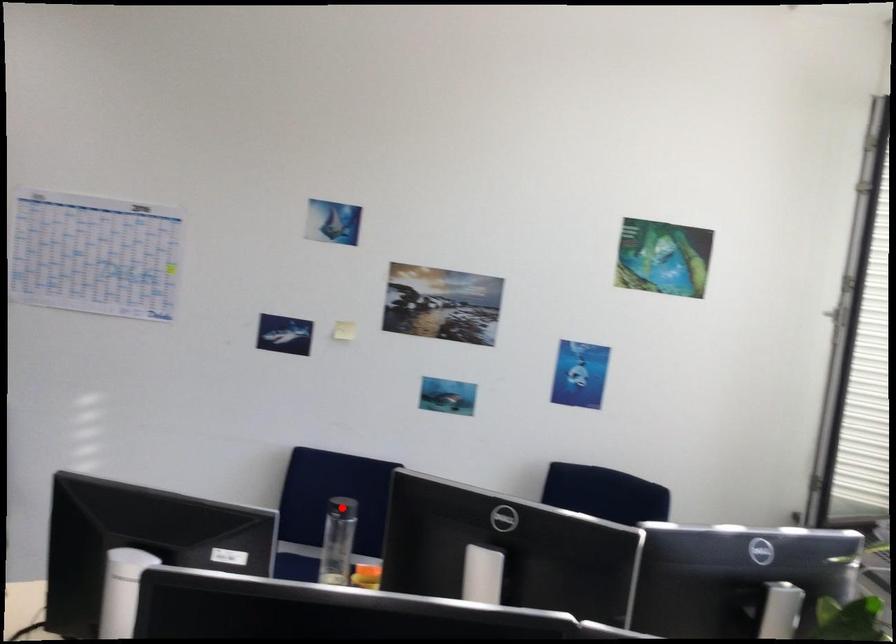
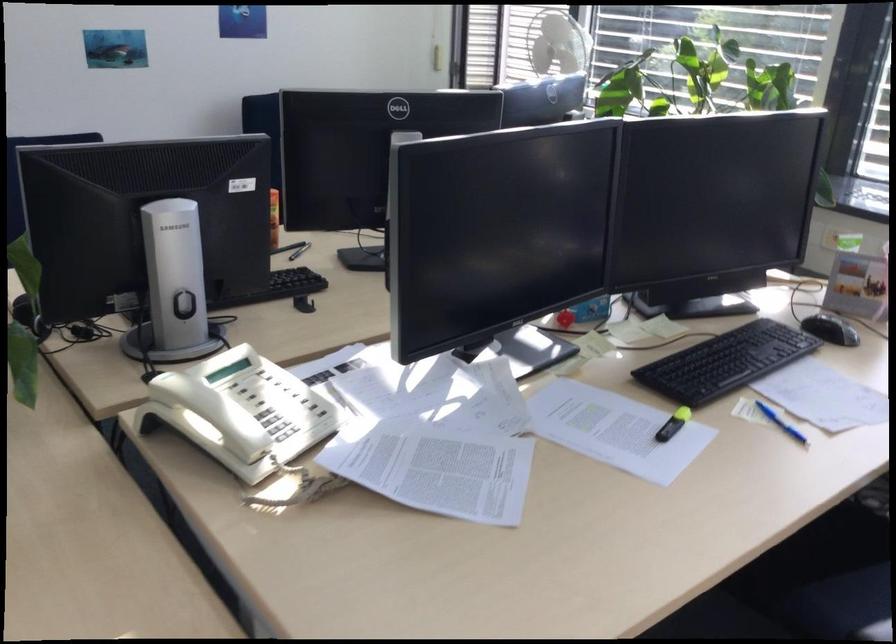
Question: I am providing you with two images of the same scene from different viewpoints. A red point is marked on the first image. At the location where the point appears in image 1, is it still visible in image 2?

Choices:
 (A) Yes
 (B) No

Answer: (B)